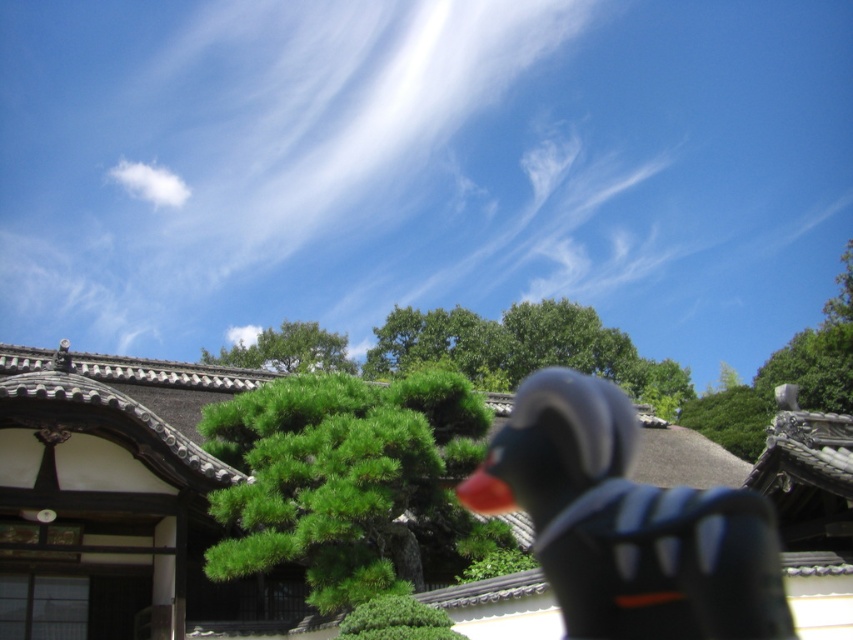
Question: Does black matte duck at center have a lesser width compared to white fluffy cloud at upper left?

Choices:
 (A) no
 (B) yes

Answer: (B)

Question: Considering the real-world distances, which object is farthest from the white fluffy cloud at upper left?

Choices:
 (A) green leafy tree at center
 (B) green matte tree at center

Answer: (B)

Question: Which is nearer to the white fluffy cloud at upper left?

Choices:
 (A) black matte duck at center
 (B) green leafy tree at center

Answer: (B)

Question: Is green matte tree at center positioned at the back of white fluffy cloud at upper left?

Choices:
 (A) no
 (B) yes

Answer: (A)

Question: Observing the image, what is the correct spatial positioning of green matte tree at center in reference to green leafy tree at center?

Choices:
 (A) above
 (B) below

Answer: (B)

Question: Estimate the real-world distances between objects in this image. Which object is farther from the green leafy tree at center?

Choices:
 (A) black matte duck at center
 (B) green matte tree at center
 (C) white fluffy cloud at upper left

Answer: (B)